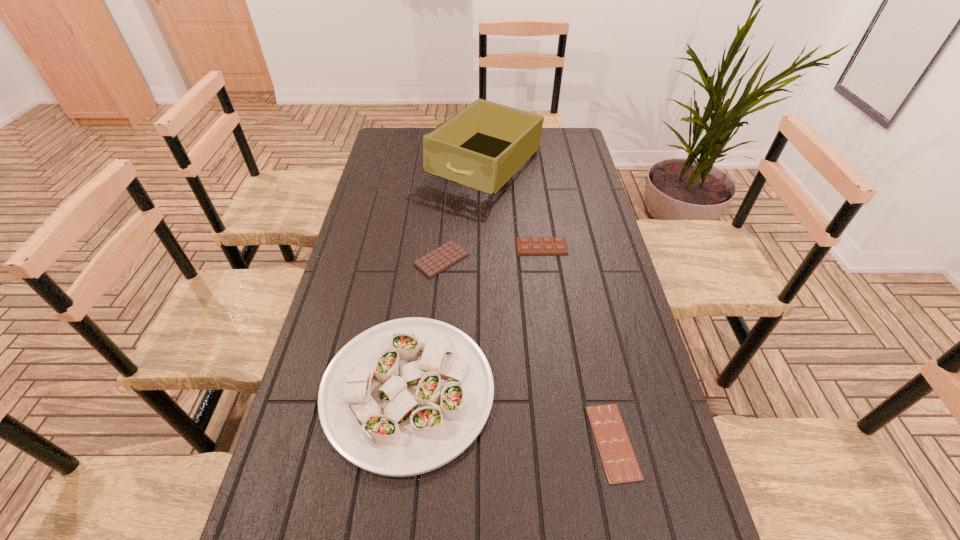
Locate an element on the screen. The width and height of the screenshot is (960, 540). empty space that is in between the platter and the tallest chocolate bar is located at coordinates (x=474, y=318).

Image resolution: width=960 pixels, height=540 pixels. Find the location of `free space between the third shortest object and the farthest object`. free space between the third shortest object and the farthest object is located at coordinates (514, 206).

Find the location of a particular element. vacant area that lies between the fourth tallest object and the tallest object is located at coordinates (464, 212).

Find the location of a particular element. free space between the third shortest object and the farthest object is located at coordinates (514, 206).

Identify which object is the third closest to the platter. Please provide its 2D coordinates. Your answer should be formatted as a tuple, i.e. [(x, y)], where the tuple contains the x and y coordinates of a point satisfying the conditions above.

[(538, 245)]

Identify which object is the fourth nearest to the leftmost chocolate bar. Please provide its 2D coordinates. Your answer should be formatted as a tuple, i.e. [(x, y)], where the tuple contains the x and y coordinates of a point satisfying the conditions above.

[(620, 464)]

Image resolution: width=960 pixels, height=540 pixels. What are the coordinates of `chocolate bar that is the second closest to the tallest object` in the screenshot? It's located at (431, 264).

Where is `chocolate bar that stands as the second closest to the platter`? The height and width of the screenshot is (540, 960). chocolate bar that stands as the second closest to the platter is located at coordinates (620, 464).

The height and width of the screenshot is (540, 960). I want to click on free spot that satisfies the following two spatial constraints: 1. on the front side of the leftmost chocolate bar; 2. on the right side of the shortest chocolate bar, so click(425, 442).

The image size is (960, 540). Identify the location of vacant space that satisfies the following two spatial constraints: 1. on the front side of the nearest chocolate bar; 2. on the left side of the fourth shortest object. (401, 442).